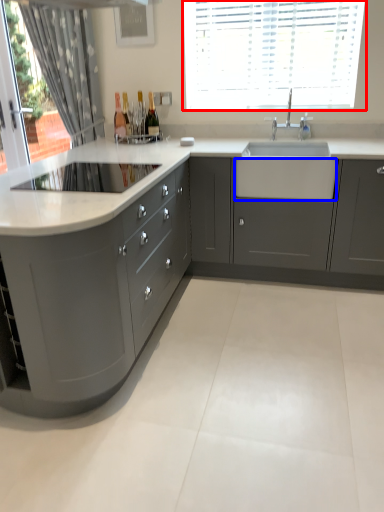
Question: Which point is closer to the camera, window (highlighted by a red box) or drawer (highlighted by a blue box)?

Choices:
 (A) window
 (B) drawer

Answer: (B)